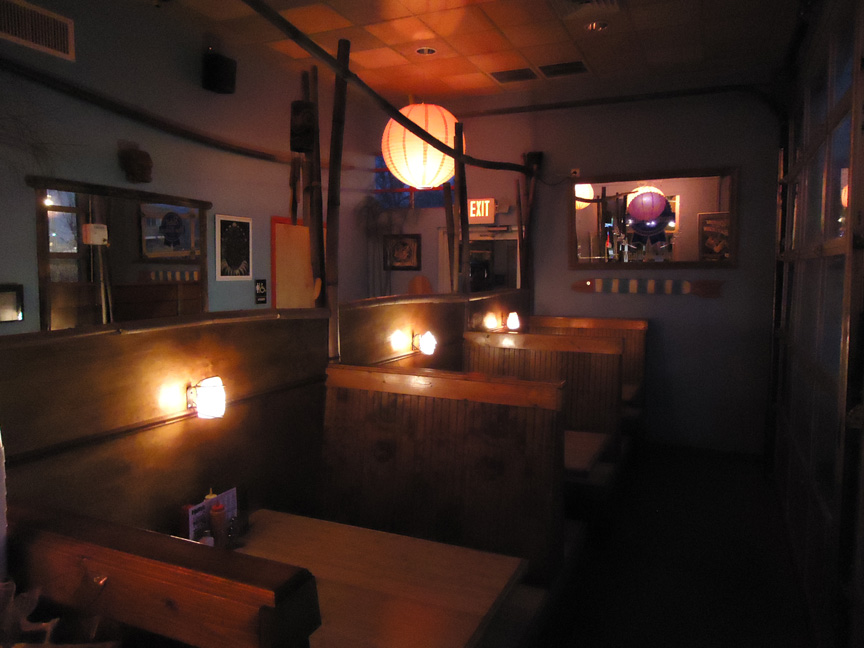
Where is `exit sign`? exit sign is located at coordinates (492, 207).